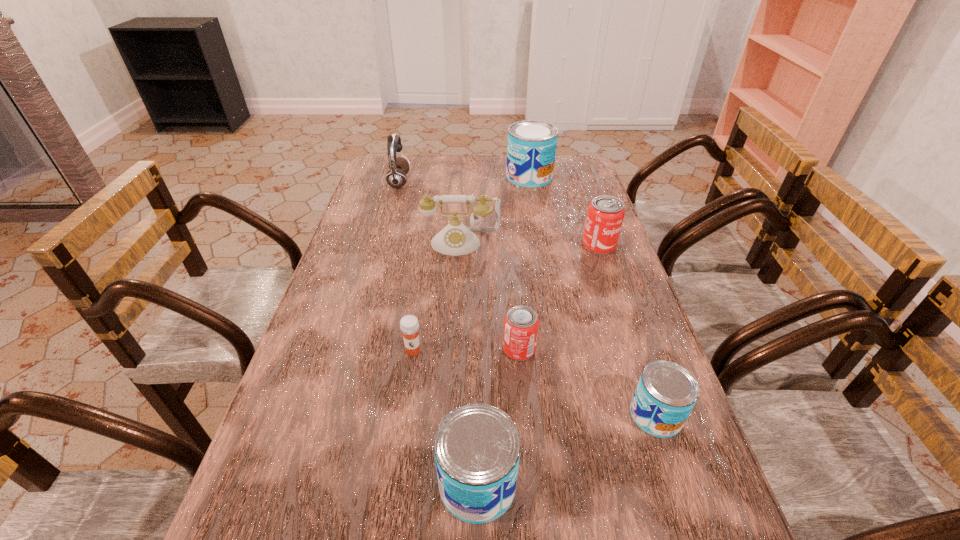
Where is `empty space between the farther red can and the white telephone`? The width and height of the screenshot is (960, 540). empty space between the farther red can and the white telephone is located at coordinates (530, 244).

What are the coordinates of `free space that is in between the nearest object and the white telephone` in the screenshot? It's located at 469,363.

Where is `free space between the rightmost blue can and the earphone`? This screenshot has width=960, height=540. free space between the rightmost blue can and the earphone is located at coordinates (527, 299).

Where is `vacant space that is in between the farther red can and the nearest object`? vacant space that is in between the farther red can and the nearest object is located at coordinates (539, 364).

I want to click on blank region between the rightmost blue can and the medicine, so click(535, 383).

At what (x,y) coordinates should I click in order to perform the action: click on free space that is in between the earphone and the second biggest blue can. Please return your answer as a coordinate pair (x, y). This screenshot has width=960, height=540. Looking at the image, I should click on (438, 333).

Find the location of a particular element. unoccupied area between the nearest blue can and the second farthest blue can is located at coordinates (566, 449).

At what (x,y) coordinates should I click in order to perform the action: click on object that is the closest one to the white telephone. Please return your answer as a coordinate pair (x, y). The width and height of the screenshot is (960, 540). Looking at the image, I should click on (396, 177).

Locate an element on the screen. the fourth closest object to the leftmost object is located at coordinates (409, 325).

I want to click on can that is the second nearest to the biggest blue can, so click(x=521, y=323).